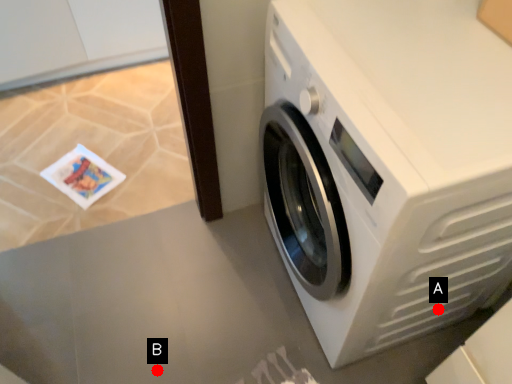
Question: Two points are circled on the image, labeled by A and B beside each circle. Which point appears farthest from the camera in this image?

Choices:
 (A) A is further
 (B) B is further

Answer: (B)